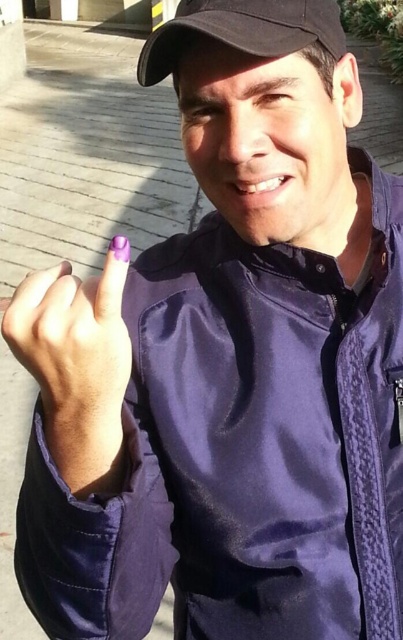
Is purple painted nail at center bigger than black matte baseball cap at upper center?

Actually, purple painted nail at center might be smaller than black matte baseball cap at upper center.

Find the location of a particular element. Image resolution: width=403 pixels, height=640 pixels. purple painted nail at center is located at coordinates (76, 364).